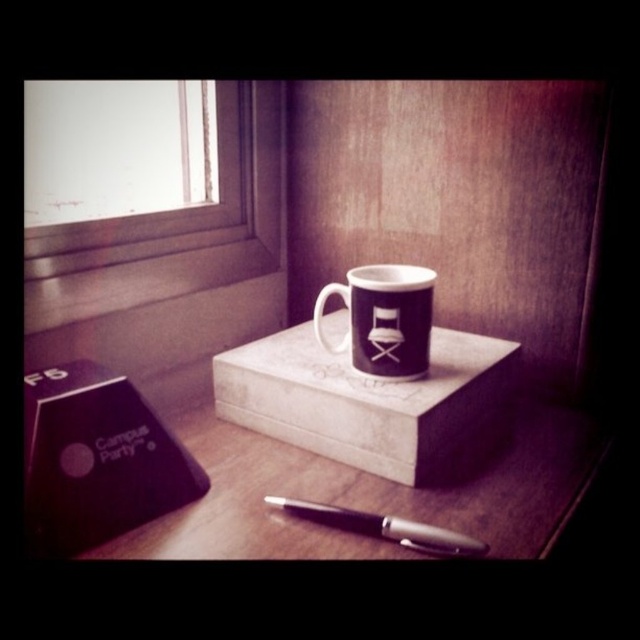
Can you confirm if transparent glass window at upper left is positioned to the right of purple matte mug at upper center?

Incorrect, transparent glass window at upper left is not on the right side of purple matte mug at upper center.

Does point (273, 243) come closer to viewer compared to point (380, 268)?

No, (273, 243) is behind (380, 268).

I want to click on transparent glass window at upper left, so click(173, 228).

Can you confirm if purple matte mug at upper center is positioned to the left of black metallic pen at lower center?

In fact, purple matte mug at upper center is to the right of black metallic pen at lower center.

Is purple matte mug at upper center positioned before black metallic pen at lower center?

No, purple matte mug at upper center is further to the viewer.

Between point (380, 324) and point (413, 522), which one is positioned in front?

Point (413, 522) is more forward.

This screenshot has height=640, width=640. What are the coordinates of `purple matte mug at upper center` in the screenshot? It's located at (384, 320).

Is matte wooden table at center below transparent glass window at upper left?

Correct, matte wooden table at center is located below transparent glass window at upper left.

Who is more forward, (212,472) or (70,225)?

Point (212,472)

This screenshot has height=640, width=640. In order to click on matte wooden table at center in this screenshot , I will do `click(376, 492)`.